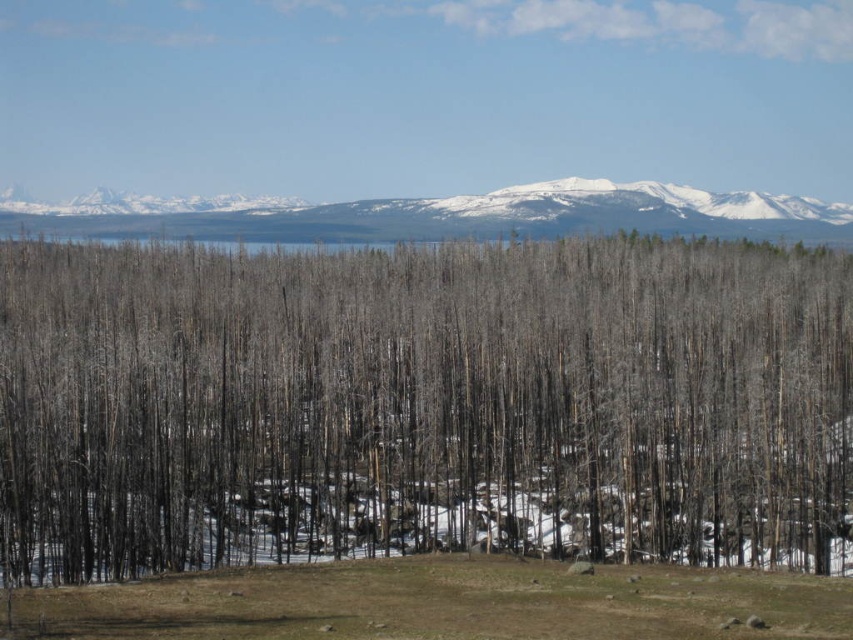
Can you confirm if charred wood trees at center is smaller than snowy granite mountain range at upper center?

Actually, charred wood trees at center might be larger than snowy granite mountain range at upper center.

Image resolution: width=853 pixels, height=640 pixels. What are the coordinates of `charred wood trees at center` in the screenshot? It's located at (422, 404).